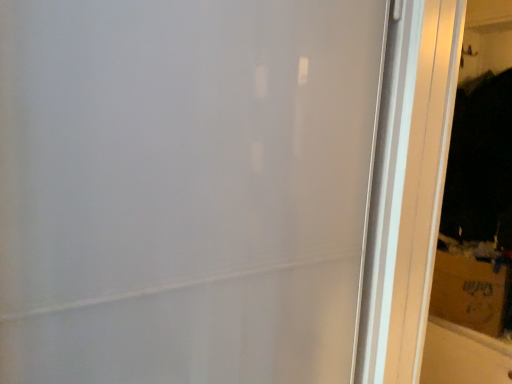
In order to face brown cardboard box at lower right, should I rotate leftwards or rightwards?

It's best to rotate right around 26.481 degrees.

The width and height of the screenshot is (512, 384). I want to click on brown cardboard box at lower right, so point(468,293).

Describe the element at coordinates (468, 293) in the screenshot. I see `brown cardboard box at lower right` at that location.

Where is `brown cardboard box at lower right`? brown cardboard box at lower right is located at coordinates (468, 293).